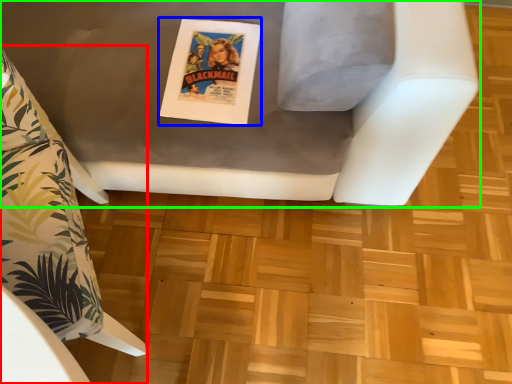
Question: Based on their relative distances, which object is nearer to furniture (highlighted by a red box)? Choose from comic book (highlighted by a blue box) and furniture (highlighted by a green box).

Choices:
 (A) comic book
 (B) furniture

Answer: (A)